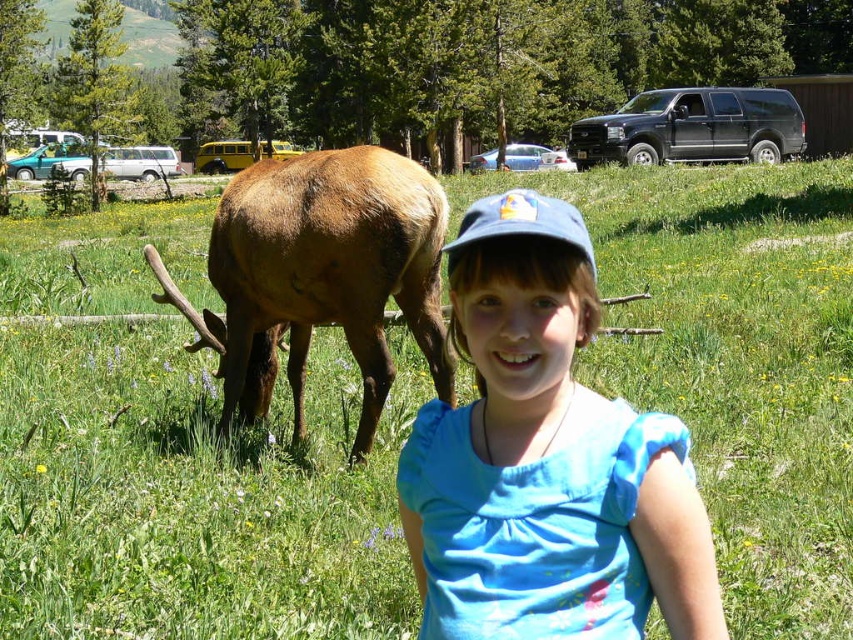
Measure the distance between blue cotton shirt at center and brown furry deer at left.

blue cotton shirt at center is 9.73 feet away from brown furry deer at left.

Which is more to the left, blue cotton shirt at center or brown furry deer at left?

brown furry deer at left is more to the left.

The width and height of the screenshot is (853, 640). What do you see at coordinates (546, 460) in the screenshot?
I see `blue cotton shirt at center` at bounding box center [546, 460].

Identify the location of blue cotton shirt at center. The image size is (853, 640). (546, 460).

Can you confirm if blue cotton shirt at center is smaller than blue fabric baseball cap at center?

Yes.

Find the location of a particular element. This screenshot has height=640, width=853. blue cotton shirt at center is located at coordinates (546, 460).

Identify the location of blue cotton shirt at center. The height and width of the screenshot is (640, 853). (546, 460).

Can you confirm if brown furry deer at left is smaller than blue fabric baseball cap at center?

Yes, brown furry deer at left is smaller than blue fabric baseball cap at center.

In the scene shown: Does brown furry deer at left lie in front of blue fabric baseball cap at center?

That is False.

Which is behind, point (265, 240) or point (526, 212)?

The point (265, 240) is behind.

Where is `brown furry deer at left`? This screenshot has width=853, height=640. brown furry deer at left is located at coordinates (321, 275).